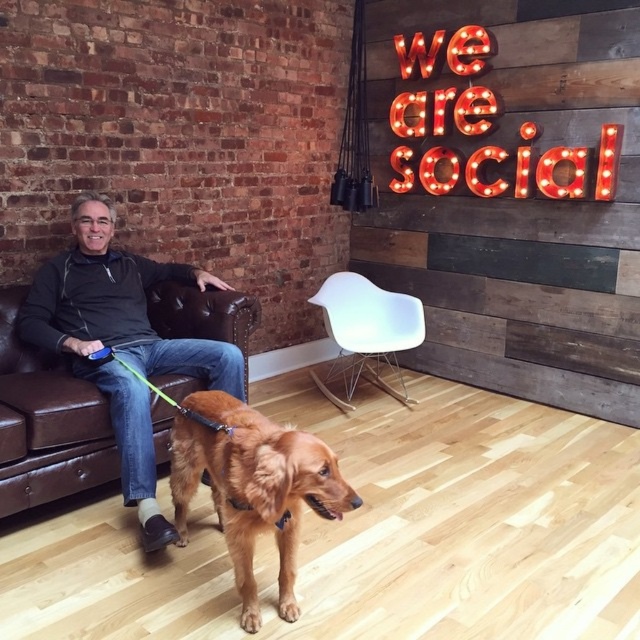
You are a guest entering the room and want to sit on the matte black leather couch at left. However, there is a golden fur dog at lower center blocking your path. Can you walk around the dog to reach the couch without disturbing it?

The matte black leather couch at left is further to the viewer than the golden fur dog at lower center, meaning the couch is closer to you. Since the dog is between you and the couch, you can walk around the dog to reach the couch without disturbing it as the couch is already in front of the dog from your perspective.

You are an interior designer assessing the layout of this room. The golden fur dog at lower center and the red illuminated letters at upper right are both important elements. Based on their sizes, which one do you think is closer to the viewer?

The golden fur dog at lower center has a lesser height compared to the red illuminated letters at upper right, which suggests that the golden fur dog at lower center is closer to the viewer since objects closer appear larger, but since it is smaller, it must be farther away. Wait, this seems contradictory. Let me think again. If the dog is smaller in the image but actually has lesser height, maybe the letters are taller in reality but farther away. Hmm, perhaps the question is about perceived distance based

You are an interior designer planning to place a new sofa in the living room. You see the golden fur dog at lower center and the red illuminated letters at upper right. Which object takes up more space in the room?

The red illuminated letters at upper right take up more space in the room than the golden fur dog at lower center.